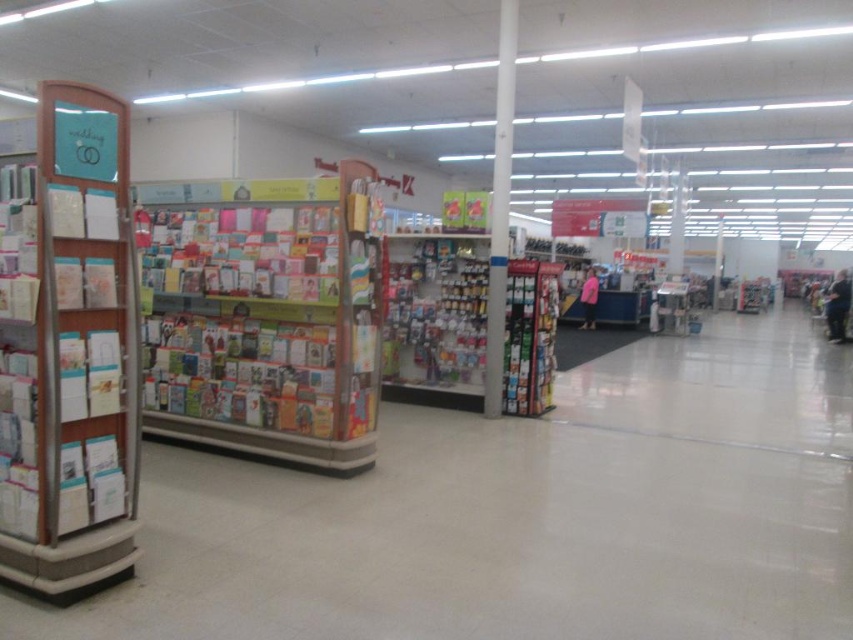
From the picture: Based on the scene description, where exactly are the multicolored paper cards at center located in terms of their 2D coordinates?

The multicolored paper cards at center are located at the 2D coordinates point (241, 252).

You are a customer in the store and want to pick up the multicolored paper cards at center. Which object is in front of the metallic silver shelves at center that you need to move past?

The multicolored paper cards at center are closer to the viewer than the metallic silver shelves at center, so you would need to move past the multicolored paper cards at center first.